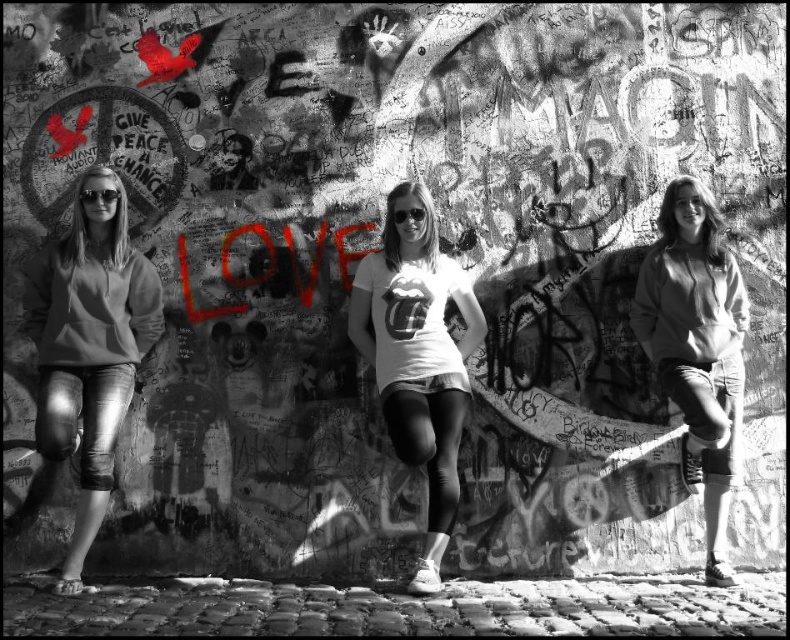
Question: Which of these objects is positioned farthest from the denim jeans at left?

Choices:
 (A) denim shorts at center
 (B) white matte t-shirt at center

Answer: (A)

Question: Is white matte t-shirt at center bigger than denim shorts at center?

Choices:
 (A) no
 (B) yes

Answer: (B)

Question: Can you confirm if white matte t-shirt at center is positioned to the left of denim shorts at center?

Choices:
 (A) yes
 (B) no

Answer: (A)

Question: Which object is the closest to the denim shorts at center?

Choices:
 (A) white matte t-shirt at center
 (B) denim jeans at left

Answer: (A)

Question: Does denim jeans at left have a greater width compared to white matte t-shirt at center?

Choices:
 (A) yes
 (B) no

Answer: (B)

Question: Which object is farther from the camera taking this photo?

Choices:
 (A) white matte t-shirt at center
 (B) denim jeans at left
 (C) denim shorts at center

Answer: (C)